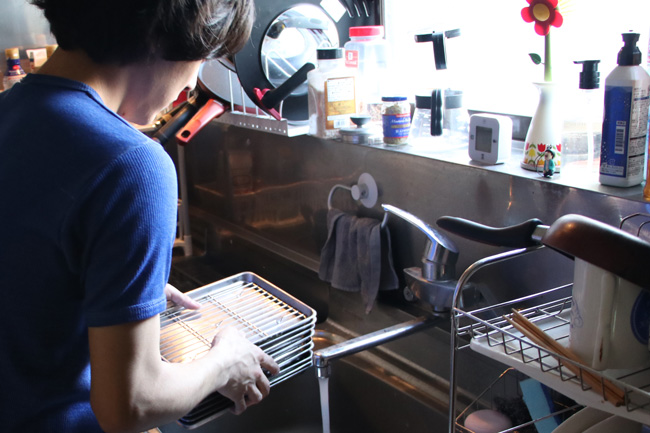
I want to click on dish rag, so click(x=357, y=246).